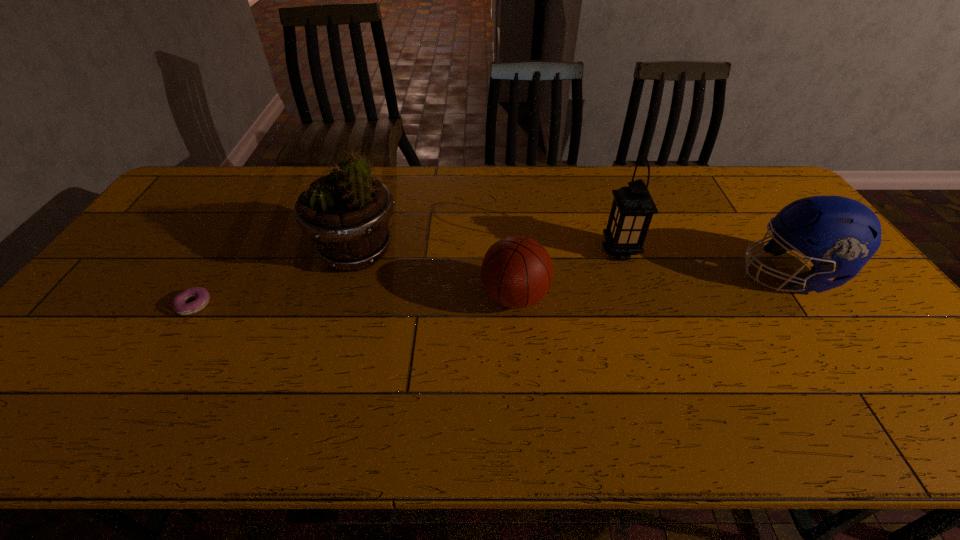
Where is `flowerpot`? The height and width of the screenshot is (540, 960). flowerpot is located at coordinates (346, 213).

Image resolution: width=960 pixels, height=540 pixels. I want to click on lantern, so click(x=632, y=209).

Where is `the fourth shortest object`? Image resolution: width=960 pixels, height=540 pixels. the fourth shortest object is located at coordinates (632, 209).

Locate an element on the screen. the third tallest object is located at coordinates (839, 235).

At what (x,y) coordinates should I click in order to perform the action: click on football helmet. Please return your answer as a coordinate pair (x, y). This screenshot has width=960, height=540. Looking at the image, I should click on (839, 235).

Locate an element on the screen. The height and width of the screenshot is (540, 960). basketball is located at coordinates (517, 271).

Find the location of `the fourth tallest object`. the fourth tallest object is located at coordinates (517, 271).

Locate an element on the screen. The width and height of the screenshot is (960, 540). the shortest object is located at coordinates (179, 303).

Locate an element on the screen. This screenshot has height=540, width=960. pastry is located at coordinates 179,303.

Find the location of a particular element. free space located on the right of the fourth object from right to left is located at coordinates (439, 252).